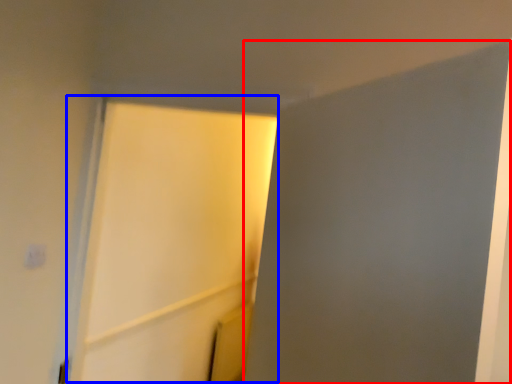
Question: Among these objects, which one is nearest to the camera, screen door (highlighted by a red box) or screen door (highlighted by a blue box)?

Choices:
 (A) screen door
 (B) screen door

Answer: (A)